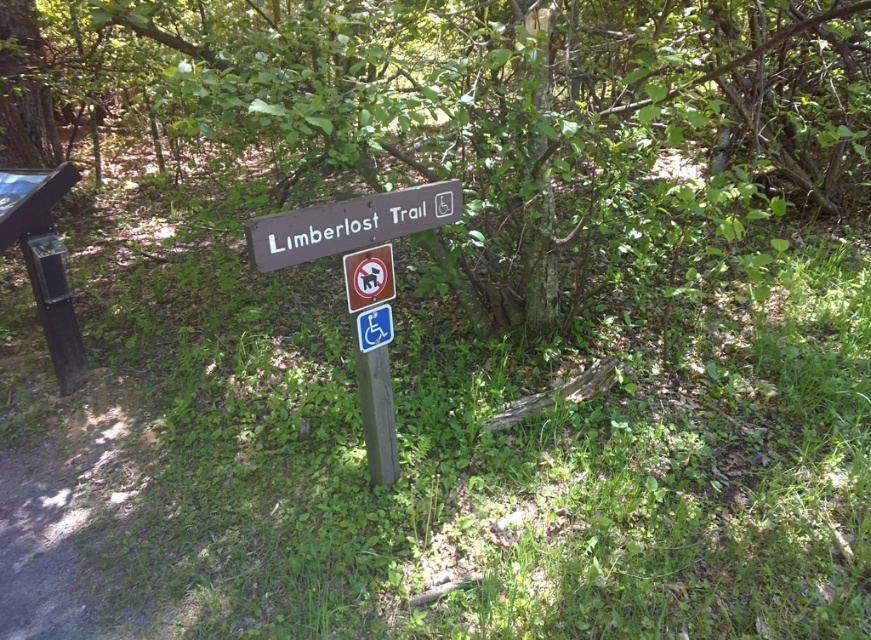
You are hiking on the Limmerlost Trail and come across two signs at the trailhead. You see a brown wood sign at center and a metallic rectangular sign at center. Which sign is located to the right of the other?

The brown wood sign at center is positioned on the right side of metallic rectangular sign at center, so it is to the right of the metallic rectangular sign at center.

You are planning to take a photo of the trail signs at the center of the scene. Which one, the brown wood sign at center or the metallic rectangular sign at center, will appear larger in your photo?

The brown wood sign at center will appear larger in the photo because it is bigger than the metallic rectangular sign at center.

You are a hiker who just arrived at the trailhead and see the metallic rectangular sign at center and the blue plastic handicap sign at center. Which one is positioned higher up on the post?

The metallic rectangular sign at center is located above the blue plastic handicap sign at center, so it is positioned higher up on the post.